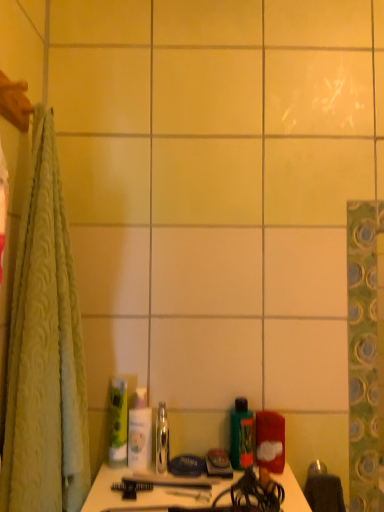
Question: Is green matte bottle at center, which is the second mouthwash from left to right, directly adjacent to matte red container at lower right, which is counted as the 1th toiletry, starting from the right?

Choices:
 (A) yes
 (B) no

Answer: (A)

Question: Does green matte bottle at center, arranged as the first mouthwash when viewed from the right, turn towards matte red container at lower right, which is the third toiletry in left-to-right order?

Choices:
 (A) yes
 (B) no

Answer: (B)

Question: Is green matte bottle at center, which is the second mouthwash from left to right, to the right of matte red container at lower right, which is counted as the 1th toiletry, starting from the right, from the viewer's perspective?

Choices:
 (A) yes
 (B) no

Answer: (B)

Question: Is green matte bottle at center, arranged as the first mouthwash when viewed from the right, wider than matte red container at lower right, which is the third toiletry in left-to-right order?

Choices:
 (A) no
 (B) yes

Answer: (A)

Question: From a real-world perspective, is green matte bottle at center, arranged as the first mouthwash when viewed from the right, on top of matte red container at lower right, which is the third toiletry in left-to-right order?

Choices:
 (A) no
 (B) yes

Answer: (B)

Question: Considering their positions, is matte red container at lower right, which is the third toiletry in left-to-right order, located in front of or behind green matte bottle at center, arranged as the first mouthwash when viewed from the right?

Choices:
 (A) front
 (B) behind

Answer: (A)

Question: Is matte red container at lower right, which is the third toiletry in left-to-right order, wider or thinner than green matte bottle at center, arranged as the first mouthwash when viewed from the right?

Choices:
 (A) wide
 (B) thin

Answer: (A)

Question: Based on their sizes in the image, would you say matte red container at lower right, which is the third toiletry in left-to-right order, is bigger or smaller than green matte bottle at center, arranged as the first mouthwash when viewed from the right?

Choices:
 (A) big
 (B) small

Answer: (A)

Question: Considering the relative positions of matte red container at lower right, which is the third toiletry in left-to-right order, and green matte bottle at center, arranged as the first mouthwash when viewed from the right, in the image provided, is matte red container at lower right, which is the third toiletry in left-to-right order, to the left or to the right of green matte bottle at center, arranged as the first mouthwash when viewed from the right,?

Choices:
 (A) left
 (B) right

Answer: (B)

Question: From a real-world perspective, is clear plastic mouthwash at center, placed as the first mouthwash when sorted from left to right, above or below green matte tube at center, the 3th toiletry viewed from the right?

Choices:
 (A) below
 (B) above

Answer: (A)

Question: Based on their sizes in the image, would you say clear plastic mouthwash at center, arranged as the 2th mouthwash when viewed from the right, is bigger or smaller than green matte tube at center, the first toiletry when ordered from left to right?

Choices:
 (A) big
 (B) small

Answer: (B)

Question: Is clear plastic mouthwash at center, placed as the first mouthwash when sorted from left to right, taller or shorter than green matte tube at center, the 3th toiletry viewed from the right?

Choices:
 (A) short
 (B) tall

Answer: (A)

Question: From the image's perspective, relative to green matte tube at center, the first toiletry when ordered from left to right, is clear plastic mouthwash at center, arranged as the 2th mouthwash when viewed from the right, above or below?

Choices:
 (A) below
 (B) above

Answer: (A)

Question: Visually, is clear plastic mouthwash at center, placed as the first mouthwash when sorted from left to right, positioned to the left or to the right of white glossy lotion at center, placed as the 2th toiletry when sorted from left to right?

Choices:
 (A) right
 (B) left

Answer: (A)

Question: Is clear plastic mouthwash at center, arranged as the 2th mouthwash when viewed from the right, wider or thinner than white glossy lotion at center, placed as the 2th toiletry when sorted from left to right?

Choices:
 (A) wide
 (B) thin

Answer: (A)